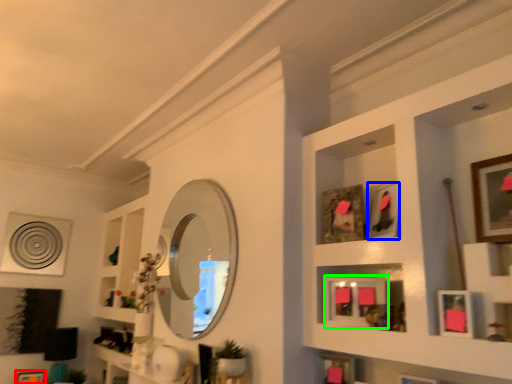
Question: Which object is positioned farthest from picture frame (highlighted by a red box)? Select from picture frame (highlighted by a blue box) and picture frame (highlighted by a green box).

Choices:
 (A) picture frame
 (B) picture frame

Answer: (A)